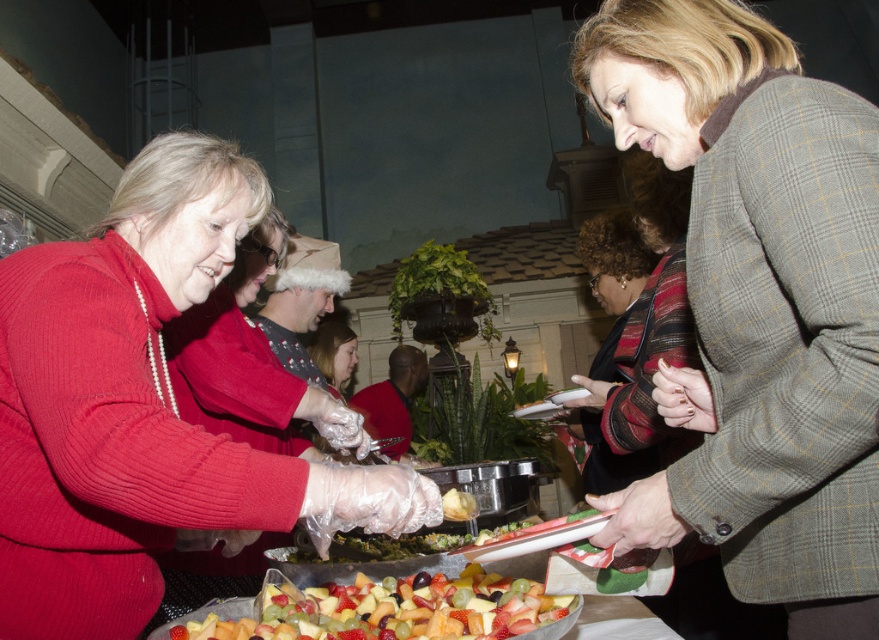
Question: Is plaid wool coat at center thinner than glossy plastic fruit at center?

Choices:
 (A) no
 (B) yes

Answer: (B)

Question: Does matte red sweater at lower left appear on the left side of glossy plastic fruit at center?

Choices:
 (A) yes
 (B) no

Answer: (A)

Question: Does plaid wool coat at center appear on the right side of glossy plastic fruit at center?

Choices:
 (A) yes
 (B) no

Answer: (A)

Question: Estimate the real-world distances between objects in this image. Which object is farther from the plaid wool coat at center?

Choices:
 (A) matte red sweater at lower left
 (B) glossy plastic fruit at center

Answer: (A)

Question: Which is nearer to the plaid wool coat at center?

Choices:
 (A) glossy plastic fruit at center
 (B) matte red sweater at lower left

Answer: (A)

Question: Which object is closer to the camera taking this photo?

Choices:
 (A) plaid wool coat at center
 (B) glossy plastic fruit at center

Answer: (A)